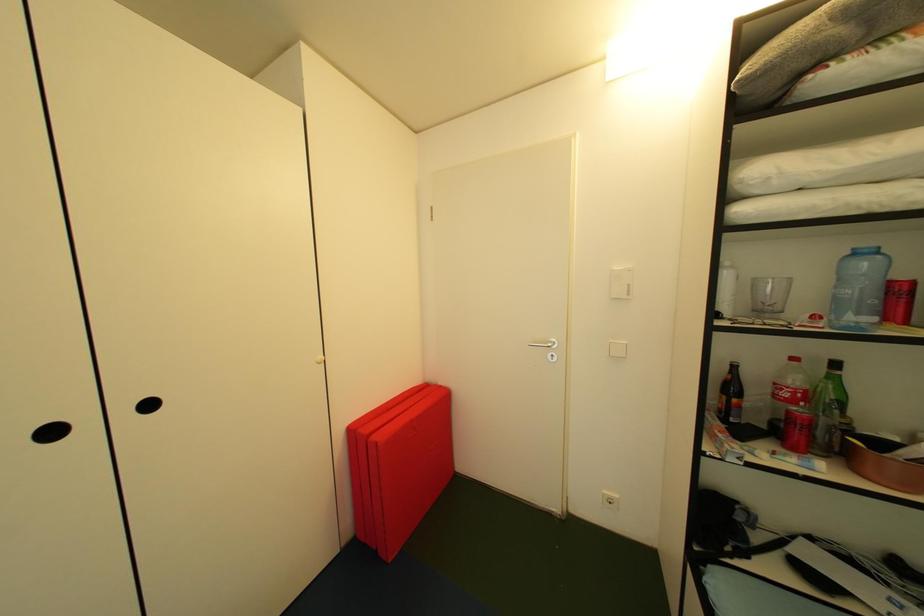
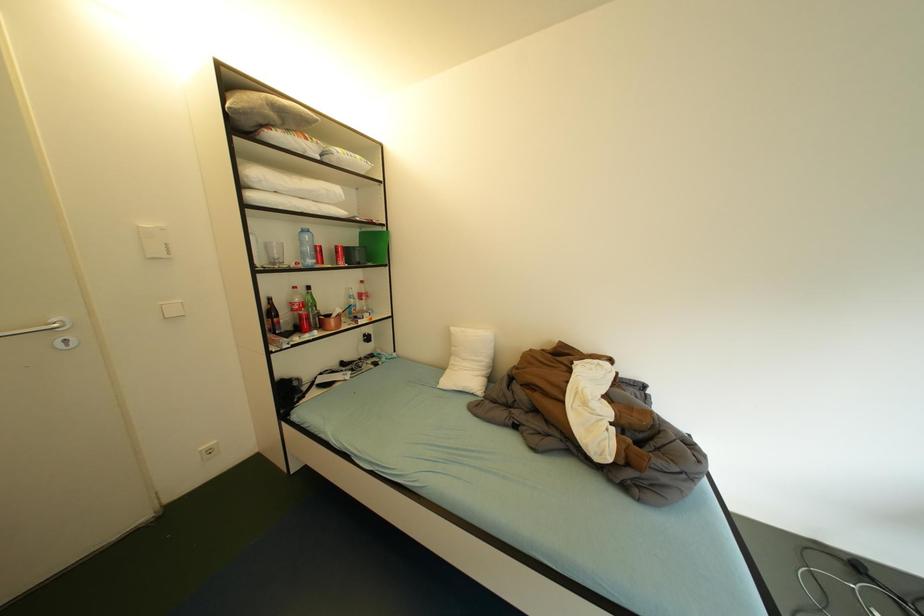
Question: The images are taken continuously from a first-person perspective. In which direction is your viewpoint rotating?

Choices:
 (A) Left
 (B) Right
 (C) Up
 (D) Down

Answer: (B)